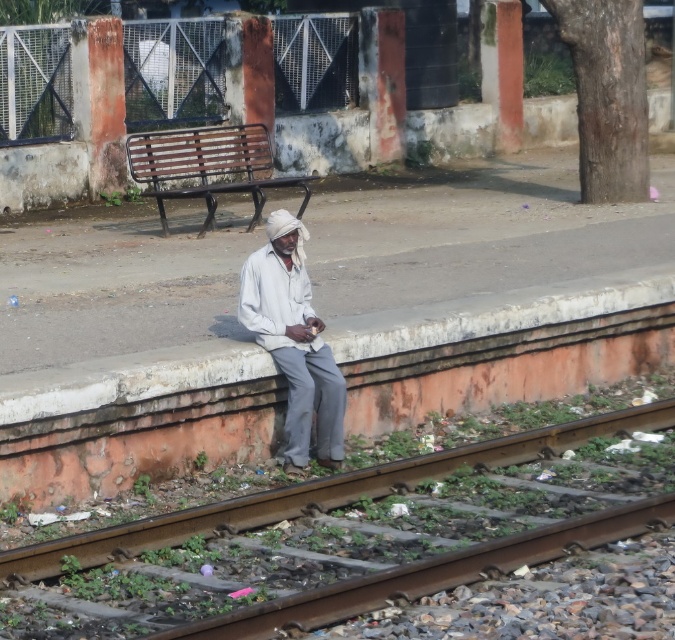
Question: Which point appears closest to the camera in this image?

Choices:
 (A) (1, 580)
 (B) (275, 272)
 (C) (250, 125)

Answer: (A)

Question: Which object is the farthest from the white cotton shirt at center?

Choices:
 (A) rusty metal train track at lower center
 (B) brown wooden bench at upper center

Answer: (B)

Question: From the image, what is the correct spatial relationship of rusty metal train track at lower center in relation to brown wooden bench at upper center?

Choices:
 (A) below
 (B) above

Answer: (A)

Question: Does white cotton shirt at center lie in front of brown wooden bench at upper center?

Choices:
 (A) no
 (B) yes

Answer: (B)

Question: Is rusty metal train track at lower center further to camera compared to brown wooden bench at upper center?

Choices:
 (A) yes
 (B) no

Answer: (B)

Question: Which object is positioned closest to the rusty metal train track at lower center?

Choices:
 (A) brown wooden bench at upper center
 (B) white cotton shirt at center

Answer: (B)